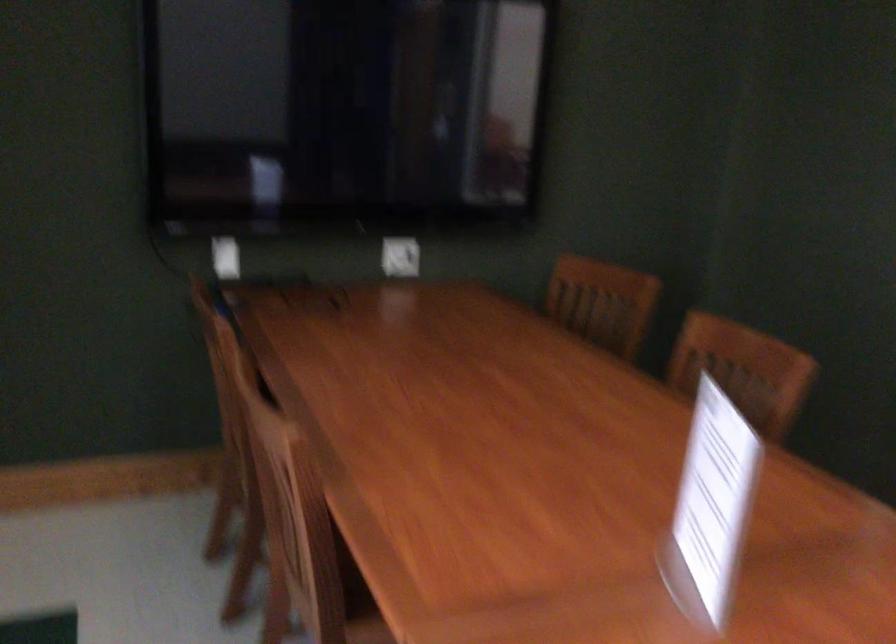
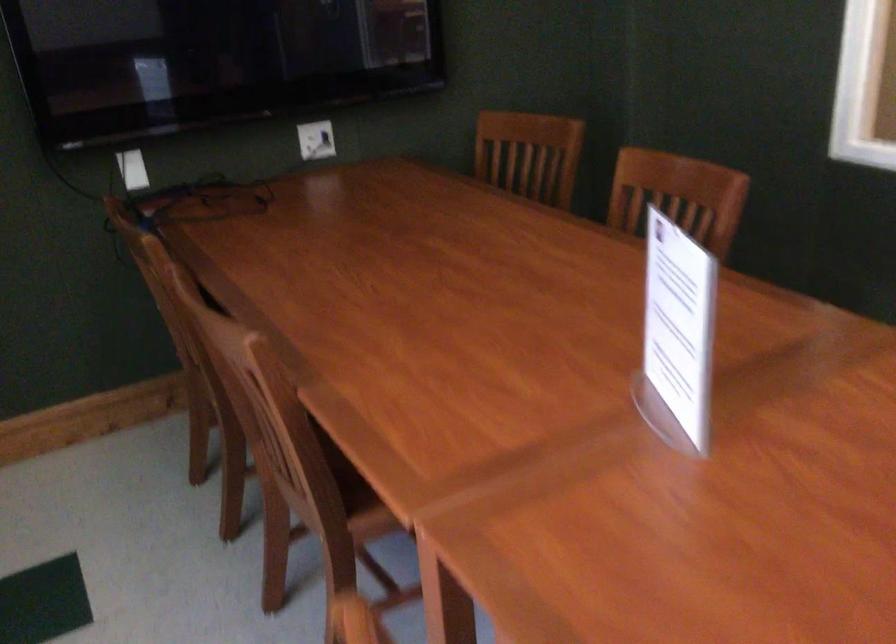
Locate, in the second image, the point that corresponds to the point at 602,301 in the first image.

(529, 154)